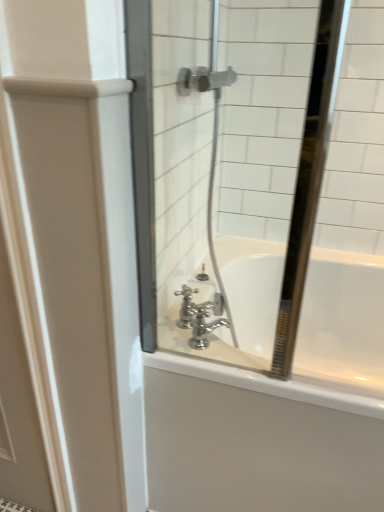
Question: Is white glossy door at left wider or thinner than white glossy bathtub at center?

Choices:
 (A) thin
 (B) wide

Answer: (A)

Question: From a real-world perspective, is white glossy door at left above or below white glossy bathtub at center?

Choices:
 (A) below
 (B) above

Answer: (B)

Question: Which of these objects is positioned farthest from the polished chrome faucet at center?

Choices:
 (A) white glossy door at left
 (B) white glossy bathtub at center
 (C) clear glass mirror at center
 (D) chrome metallic faucet at center

Answer: (C)

Question: Which is nearer to the white glossy door at left?

Choices:
 (A) clear glass mirror at center
 (B) polished chrome faucet at center
 (C) white glossy bathtub at center
 (D) chrome metallic faucet at center

Answer: (C)